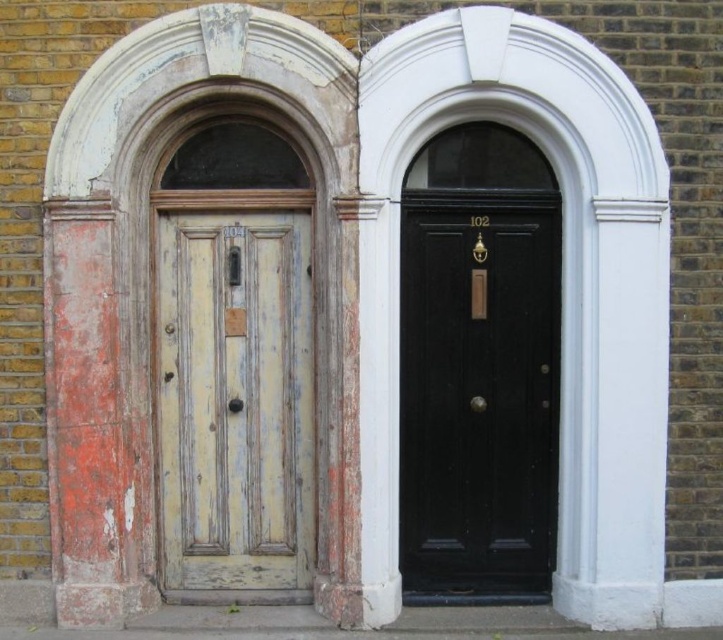
You are standing in front of two doors. The left door has peeling paint and the number 104, while the right door is black and polished. A point at coordinates (x=479, y=388) is marked. Which door does this point belong to?

The point at (x=479, y=388) corresponds to the black polished wood door at center, so it belongs to the right door.

Consider the image. You are standing in front of two doors. You need to determine which point is closer to you. The points are point (523, 186) and point (307, 525). Which one is closer?

Point (523, 186) is closer to the camera than point (307, 525).